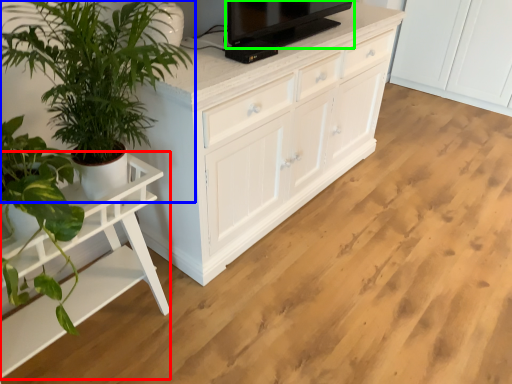
Question: Which is farther away from table (highlighted by a red box)? houseplant (highlighted by a blue box) or television (highlighted by a green box)?

Choices:
 (A) houseplant
 (B) television

Answer: (B)